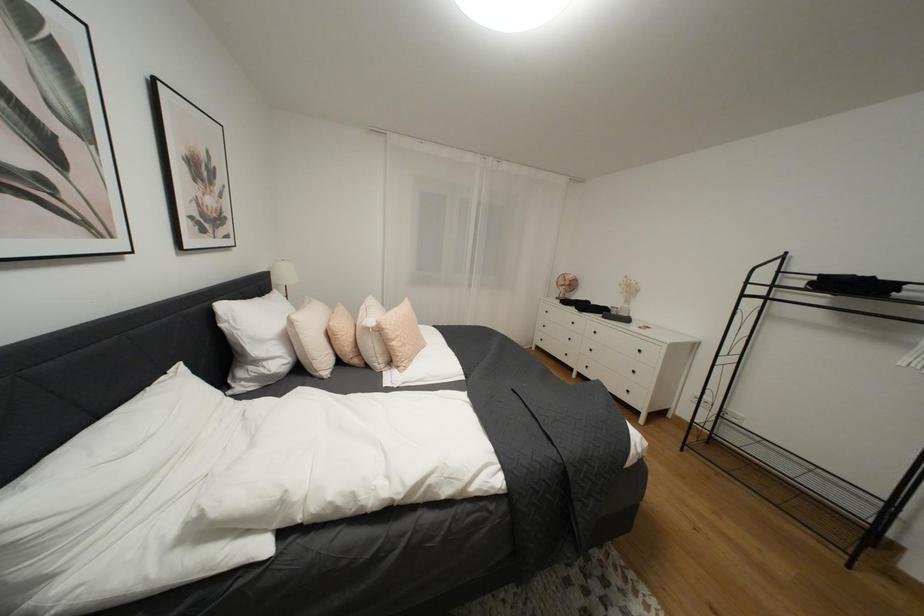
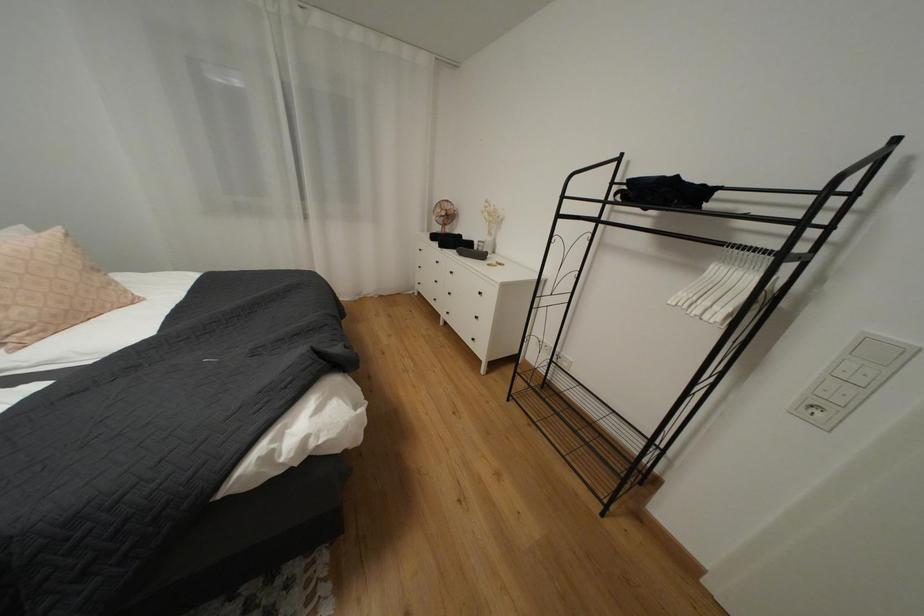
In a continuous first-person perspective shot, in which direction is the camera moving?

The cameraman moved toward right, forward.